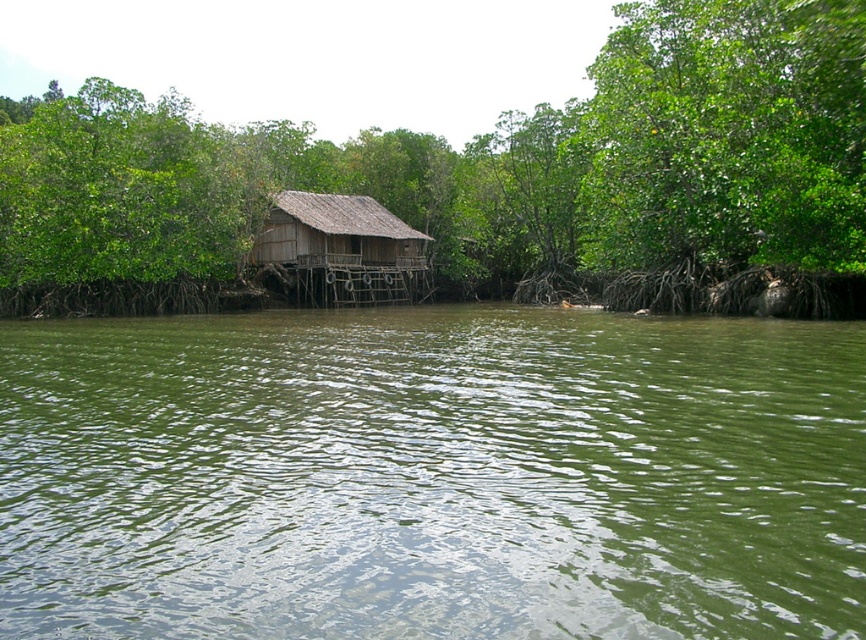
You are standing on the riverside path and see the green leafy tree at center and the wooden thatched hut at center. Which object is nearer to you?

The green leafy tree at center is closer to the viewer than the wooden thatched hut at center, so the green leafy tree at center is nearer to you.

You are standing at the edge of the riverside scene and want to place a small boat in the green water at center. According to the coordinates provided, where exactly should you position the boat?

The green water at center is located at point [433,476], so you should position the boat at those coordinates to ensure it is placed correctly within the green water at center.

You are standing on the riverside path and see the wooden thatched hut at center and the green water at center. Which object is located lower in the scene?

The green water at center is located lower than the wooden thatched hut at center because the green water at center is below wooden thatched hut at center.